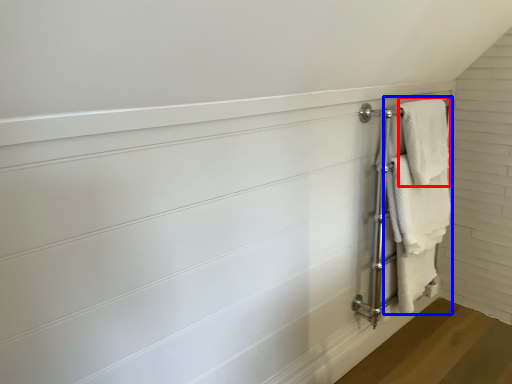
Question: Which point is closer to the camera, bath towel (highlighted by a red box) or bath towel (highlighted by a blue box)?

Choices:
 (A) bath towel
 (B) bath towel

Answer: (B)